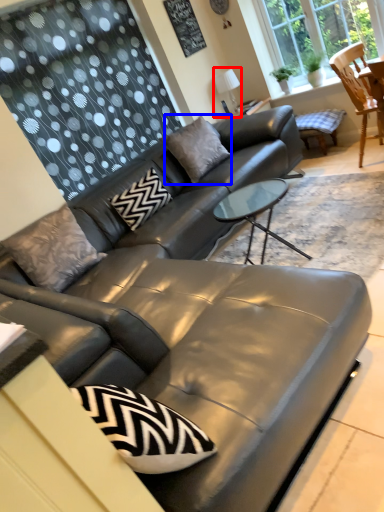
Question: Which of the following is the closest to the observer, lamp (highlighted by a red box) or pillow (highlighted by a blue box)?

Choices:
 (A) lamp
 (B) pillow

Answer: (B)